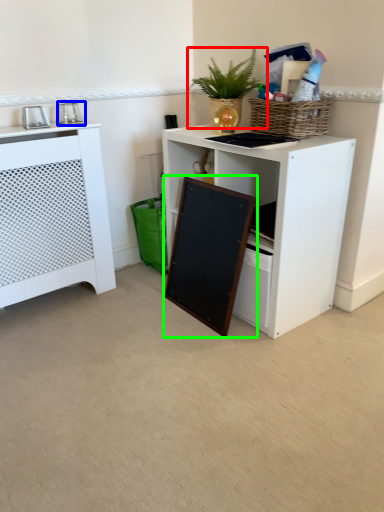
Question: Which object is positioned farthest from houseplant (highlighted by a red box)? Select from appliance (highlighted by a blue box) and screen door (highlighted by a green box).

Choices:
 (A) appliance
 (B) screen door

Answer: (A)